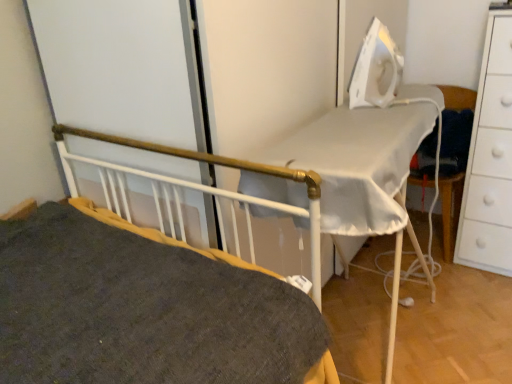
Image resolution: width=512 pixels, height=384 pixels. I want to click on free space underneath white plastic iron at upper right (from a real-world perspective), so click(366, 308).